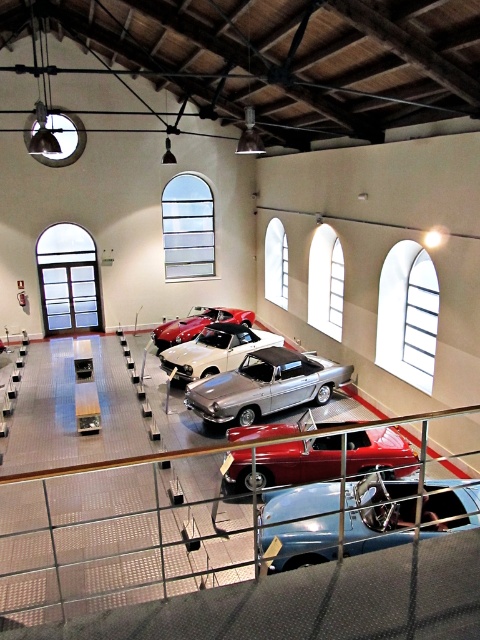
Can you confirm if glossy metallic car at center is thinner than white metallic car at center?

No.

At what (x,y) coordinates should I click in order to perform the action: click on glossy metallic car at center. Please return your answer as a coordinate pair (x, y). Looking at the image, I should click on (298, 461).

Can you confirm if silver metallic car at center is positioned to the right of white metallic car at center?

Correct, you'll find silver metallic car at center to the right of white metallic car at center.

Which is more to the right, silver metallic car at center or white metallic car at center?

silver metallic car at center

Does point (264, 390) lie in front of point (188, 380)?

Yes.

The image size is (480, 640). Identify the location of silver metallic car at center. (264, 387).

Looking at this image, does glossy metallic car at center appear on the left side of silver metallic car at center?

In fact, glossy metallic car at center is to the right of silver metallic car at center.

Is glossy metallic car at center to the right of silver metallic car at center from the viewer's perspective?

Correct, you'll find glossy metallic car at center to the right of silver metallic car at center.

Based on the photo, who is more forward, (299, 426) or (228, 413)?

Point (299, 426) is more forward.

Where is `glossy metallic car at center`? The width and height of the screenshot is (480, 640). glossy metallic car at center is located at coordinates (298, 461).